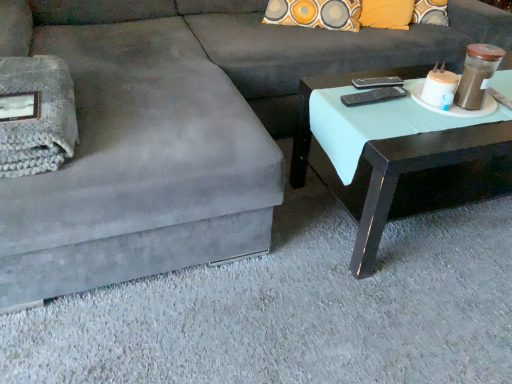
Question: Is black plastic remote at upper right, marked as the first remote in a top-to-bottom arrangement, positioned far away from matte black coffee table at right?

Choices:
 (A) yes
 (B) no

Answer: (B)

Question: From the image's perspective, is black plastic remote at upper right, the first remote viewed from the back, below matte black coffee table at right?

Choices:
 (A) no
 (B) yes

Answer: (A)

Question: Is black plastic remote at upper right, which is the second remote in front-to-back order, aimed at matte black coffee table at right?

Choices:
 (A) no
 (B) yes

Answer: (A)

Question: Does black plastic remote at upper right, the first remote viewed from the back, come behind matte black coffee table at right?

Choices:
 (A) yes
 (B) no

Answer: (A)

Question: Considering the relative sizes of black plastic remote at upper right, the first remote viewed from the back, and matte black coffee table at right in the image provided, is black plastic remote at upper right, the first remote viewed from the back, shorter than matte black coffee table at right?

Choices:
 (A) no
 (B) yes

Answer: (B)

Question: Is black plastic remote at upper right, marked as the first remote in a top-to-bottom arrangement, turned away from matte black coffee table at right?

Choices:
 (A) yes
 (B) no

Answer: (B)

Question: Is matte black coffee table at right behind black plastic remote at upper right, the 1th remote in the front-to-back sequence?

Choices:
 (A) no
 (B) yes

Answer: (A)

Question: Is matte black coffee table at right smaller than black plastic remote at upper right, which ranks as the 2th remote in top-to-bottom order?

Choices:
 (A) no
 (B) yes

Answer: (A)

Question: Does matte black coffee table at right have a larger size compared to black plastic remote at upper right, which ranks as the 2th remote in top-to-bottom order?

Choices:
 (A) no
 (B) yes

Answer: (B)

Question: From the image's perspective, is matte black coffee table at right on top of black plastic remote at upper right, which ranks as the 2th remote in top-to-bottom order?

Choices:
 (A) yes
 (B) no

Answer: (B)

Question: Could black plastic remote at upper right, the 1th remote from the bottom, be considered to be inside matte black coffee table at right?

Choices:
 (A) yes
 (B) no

Answer: (B)

Question: Is matte black coffee table at right outside black plastic remote at upper right, the 1th remote from the bottom?

Choices:
 (A) no
 (B) yes

Answer: (B)

Question: Is black plastic remote at upper right, which is the second remote in front-to-back order, oriented towards black plastic remote at upper right, which ranks as the 2th remote in top-to-bottom order?

Choices:
 (A) no
 (B) yes

Answer: (B)